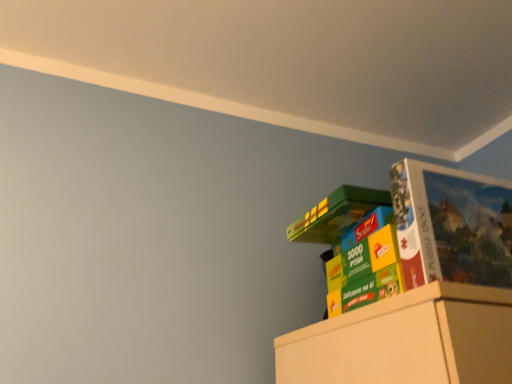
Question: Looking at their shapes, would you say multicolored cardboard puzzle box at upper right is wider or thinner than matte cardboard puzzle at upper right?

Choices:
 (A) wide
 (B) thin

Answer: (A)

Question: From the image's perspective, is multicolored cardboard puzzle box at upper right located above or below matte cardboard puzzle at upper right?

Choices:
 (A) above
 (B) below

Answer: (B)

Question: Is point (381, 200) positioned closer to the camera than point (488, 233)?

Choices:
 (A) farther
 (B) closer

Answer: (A)

Question: Is matte cardboard puzzle at upper right in front of or behind multicolored cardboard puzzle box at upper right in the image?

Choices:
 (A) front
 (B) behind

Answer: (A)

Question: From a real-world perspective, is matte cardboard puzzle at upper right physically located above or below multicolored cardboard puzzle box at upper right?

Choices:
 (A) below
 (B) above

Answer: (B)

Question: Considering the positions of matte cardboard puzzle at upper right and multicolored cardboard puzzle box at upper right in the image, is matte cardboard puzzle at upper right bigger or smaller than multicolored cardboard puzzle box at upper right?

Choices:
 (A) big
 (B) small

Answer: (B)

Question: Does point click(414, 221) appear closer or farther from the camera than point click(339, 188)?

Choices:
 (A) closer
 (B) farther

Answer: (A)